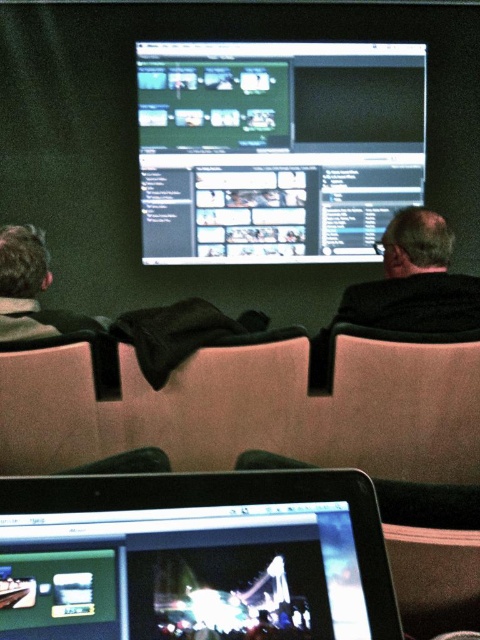
Can you confirm if matte black monitor at center is positioned to the right of gray woolen sweater at left?

Correct, you'll find matte black monitor at center to the right of gray woolen sweater at left.

Consider the image. Who is more distant from viewer, (319, 202) or (55, 308)?

Positioned behind is point (55, 308).

Is point (173, 124) positioned behind point (0, 259)?

Yes, point (173, 124) is farther from viewer.

Image resolution: width=480 pixels, height=640 pixels. What are the coordinates of `matte black monitor at center` in the screenshot? It's located at (276, 148).

What do you see at coordinates (192, 556) in the screenshot? This screenshot has width=480, height=640. I see `shiny silver laptop at lower center` at bounding box center [192, 556].

Who is more distant from viewer, (216, 528) or (36, 273)?

The point (36, 273) is more distant.

Where is `shiny silver laptop at lower center`? shiny silver laptop at lower center is located at coordinates (192, 556).

Identify the location of shiny silver laptop at lower center. The image size is (480, 640). (192, 556).

This screenshot has height=640, width=480. What are the coordinates of `shiny silver laptop at lower center` in the screenshot? It's located at (192, 556).